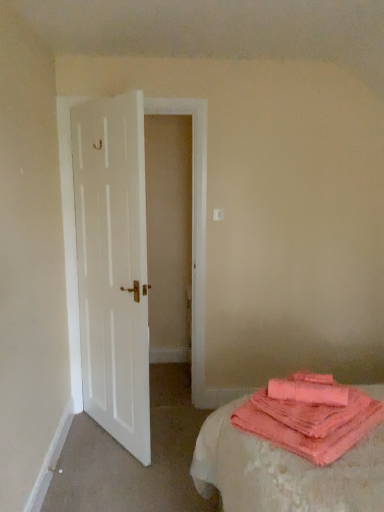
Find the location of a particular element. This screenshot has width=384, height=512. free space in front of white wooden door at left is located at coordinates tap(121, 467).